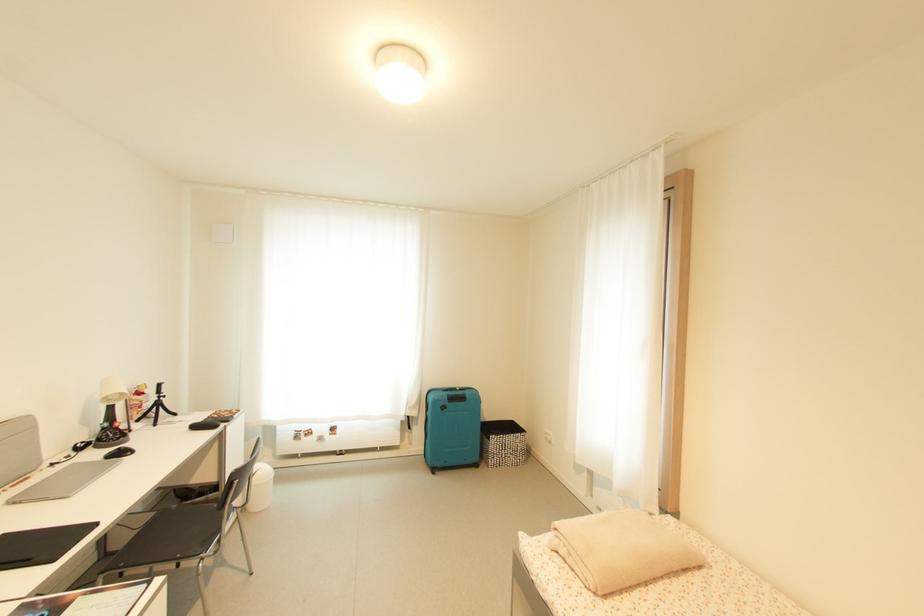
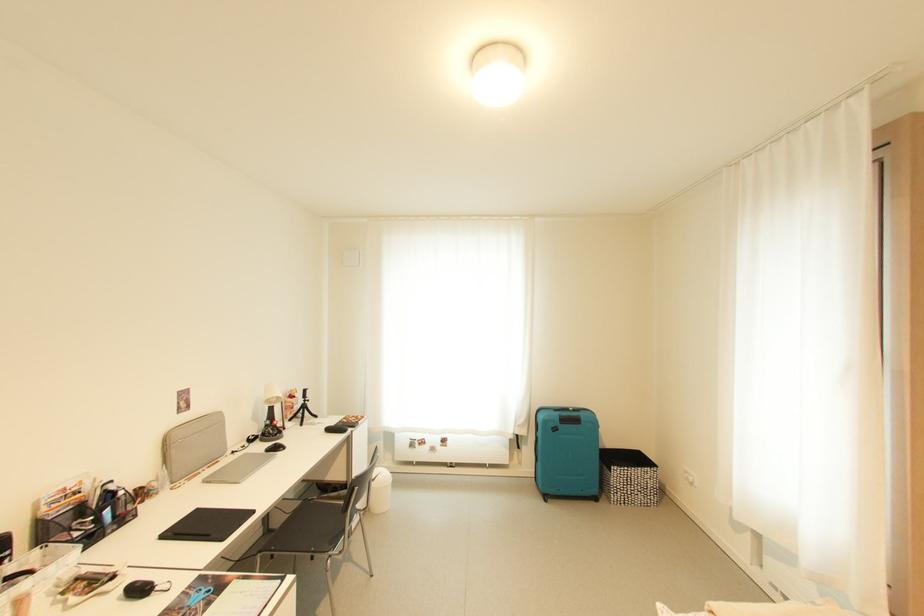
Locate, in the second image, the point that corresponds to point 119,554 in the first image.

(276, 533)